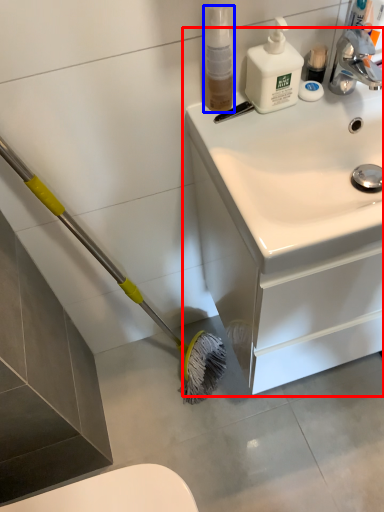
Question: Which of the following is the farthest to the observer, bathroom cabinet (highlighted by a red box) or cleaning product (highlighted by a blue box)?

Choices:
 (A) bathroom cabinet
 (B) cleaning product

Answer: (B)